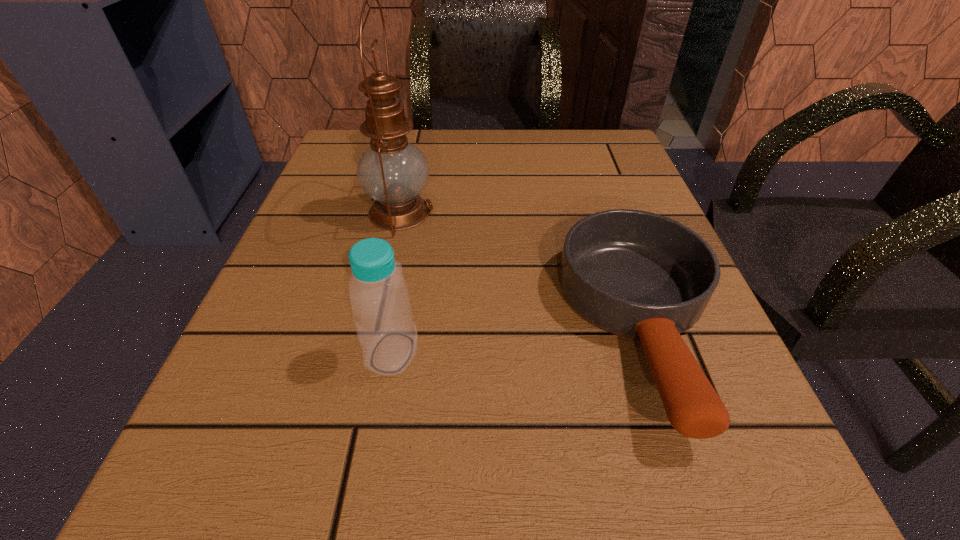
Locate an element on the screen. The height and width of the screenshot is (540, 960). blank region between the pan and the bottle is located at coordinates (517, 340).

Locate an element on the screen. vacant space in between the tallest object and the shortest object is located at coordinates (521, 270).

Where is `free area in between the tallest object and the rightmost object`? This screenshot has width=960, height=540. free area in between the tallest object and the rightmost object is located at coordinates pyautogui.click(x=521, y=270).

I want to click on vacant area that lies between the shortest object and the tallest object, so click(x=521, y=270).

I want to click on the closest object to the pan, so click(x=379, y=295).

Select which object is the closest to the farthest object. Please provide its 2D coordinates. Your answer should be formatted as a tuple, i.e. [(x, y)], where the tuple contains the x and y coordinates of a point satisfying the conditions above.

[(379, 295)]